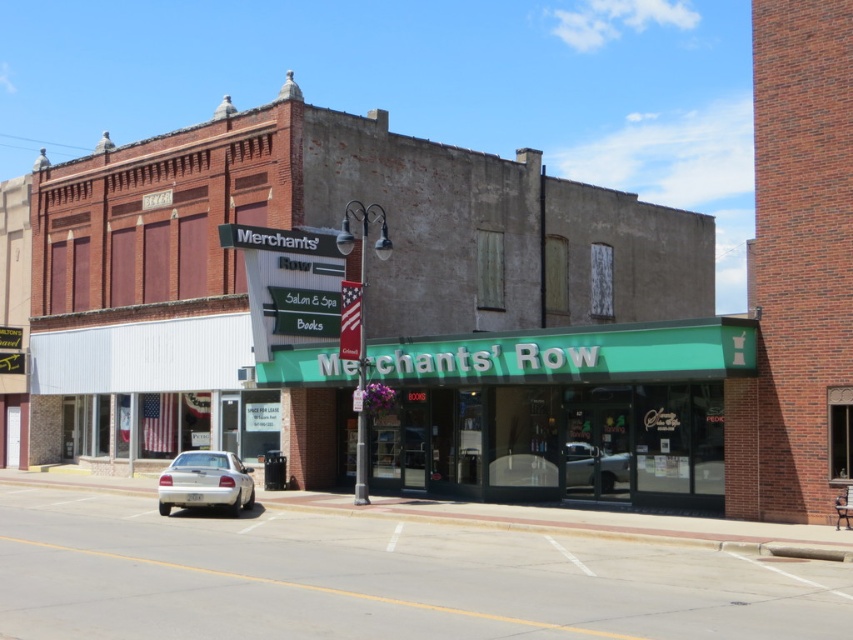
You are standing on the street looking at the scene. Which object is nearer to you, the green glass storefront at center or the silver metallic sedan at lower left?

The green glass storefront at center is closer to the viewer than the silver metallic sedan at lower left.

Looking at this image, you are a delivery person needing to park your vehicle in the parking spot located between the two silver metallic cars. The parking spot can only accommodate vehicles up to the size of the silver metallic car at center. Can your vehicle, which is the same size as the silver metallic sedan at lower left, fit into the spot?

The silver metallic sedan at lower left is bigger than the silver metallic car at center. Since the parking spot can only accommodate vehicles up to the size of the silver metallic car at center, your vehicle, being larger, cannot fit into the spot.

You are standing at the point closest to the main building. Which point, point [543,406] or point [566,452], is farther away from you?

Point [543,406] is farther away because it is behind point [566,452].